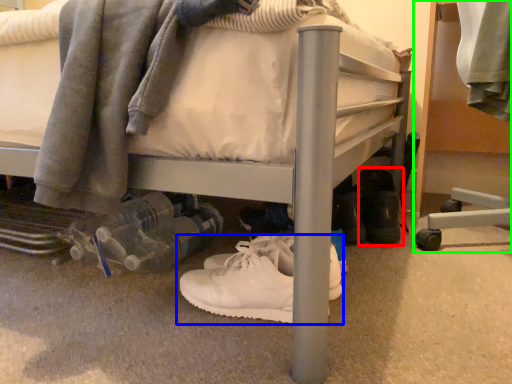
Question: Considering the real-world distances, which object is farthest from footwear (highlighted by a red box)? footwear (highlighted by a blue box) or furniture (highlighted by a green box)?

Choices:
 (A) footwear
 (B) furniture

Answer: (A)